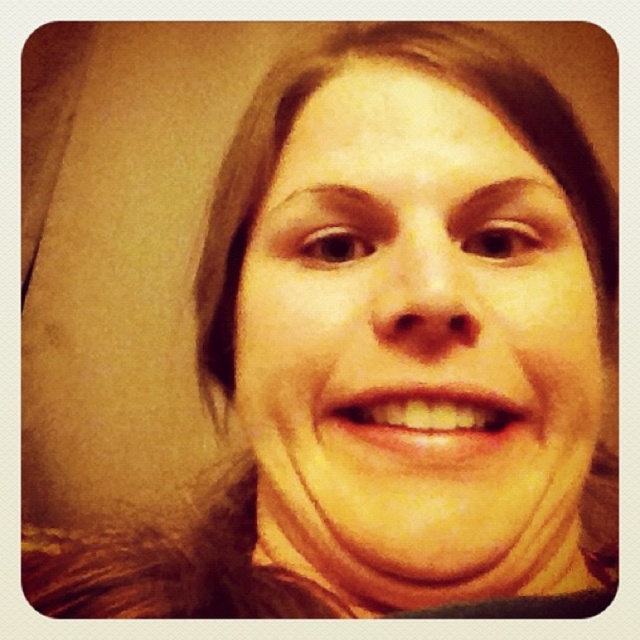
Does smooth skin face at center have a smaller size compared to yellow matte teeth at center?

No, smooth skin face at center is not smaller than yellow matte teeth at center.

Who is lower down, smooth skin face at center or yellow matte teeth at center?

yellow matte teeth at center

The width and height of the screenshot is (640, 640). Find the location of `smooth skin face at center`. smooth skin face at center is located at coordinates (419, 330).